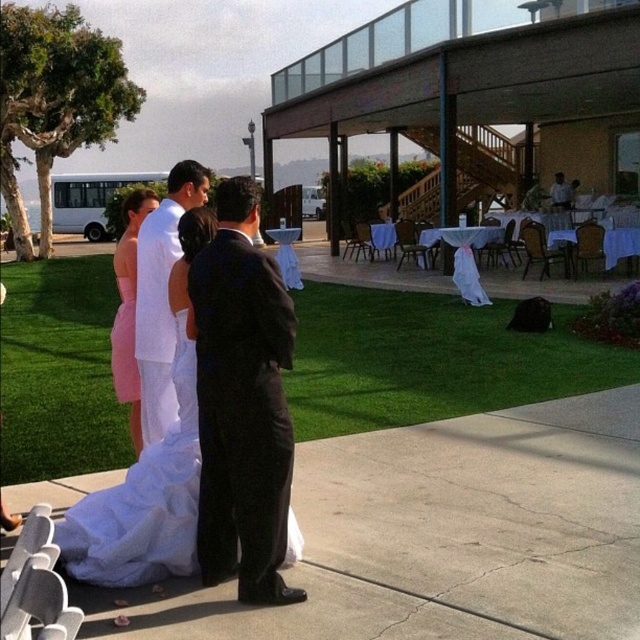
Question: Can you confirm if white satin dress at center is positioned to the right of pink satin dress at center?

Choices:
 (A) no
 (B) yes

Answer: (B)

Question: Observing the image, what is the correct spatial positioning of white satin dress at center in reference to white matte suit at center?

Choices:
 (A) left
 (B) right

Answer: (A)

Question: Which object is the closest to the white matte suit at center?

Choices:
 (A) black satin suit at center
 (B) white satin dress at center
 (C) pink satin dress at center

Answer: (B)

Question: Among these points, which one is farthest from the camera?

Choices:
 (A) (138, 436)
 (B) (234, 376)
 (C) (172, 406)

Answer: (A)

Question: Does black satin suit at center appear under white matte suit at center?

Choices:
 (A) no
 (B) yes

Answer: (B)

Question: Which object is the closest to the white matte suit at center?

Choices:
 (A) white satin dress at center
 (B) pink satin dress at center
 (C) black satin suit at center

Answer: (A)